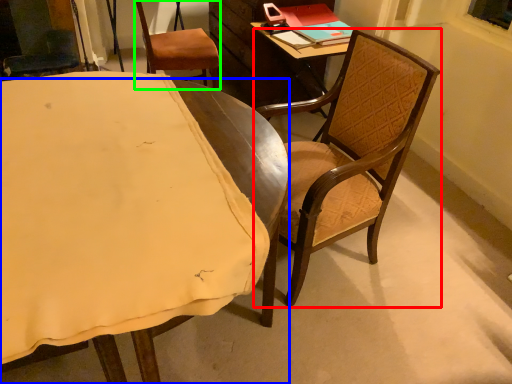
Question: Which object is positioned farthest from chair (highlighted by a red box)? Select from chair (highlighted by a blue box) and chair (highlighted by a green box).

Choices:
 (A) chair
 (B) chair

Answer: (B)